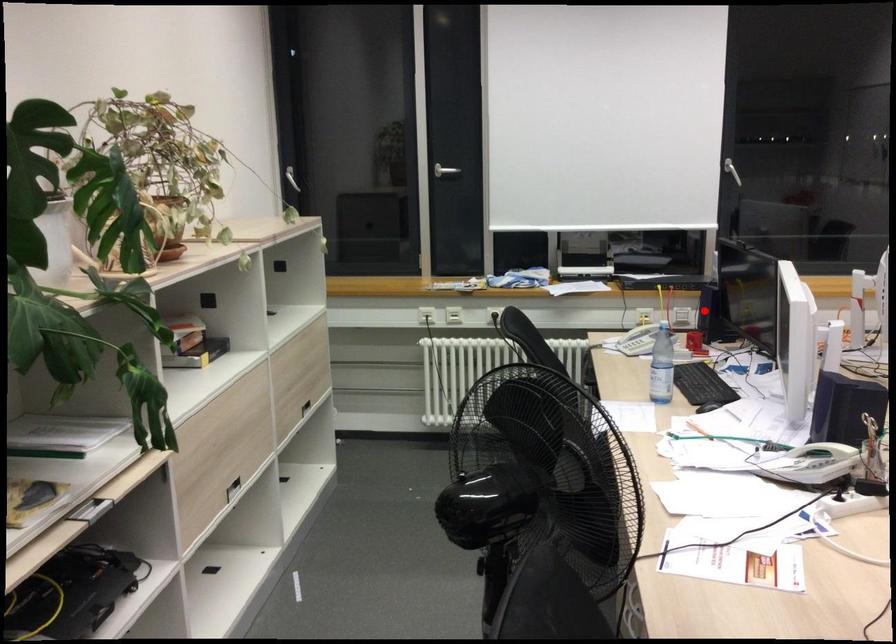
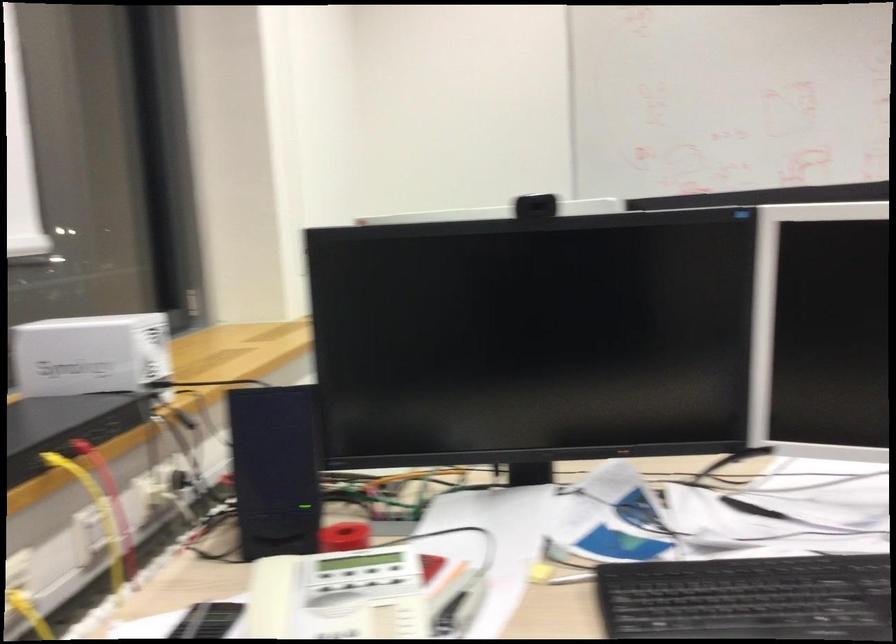
Find the pixel in the second image that matches the highlighted location in the first image.

(274, 469)